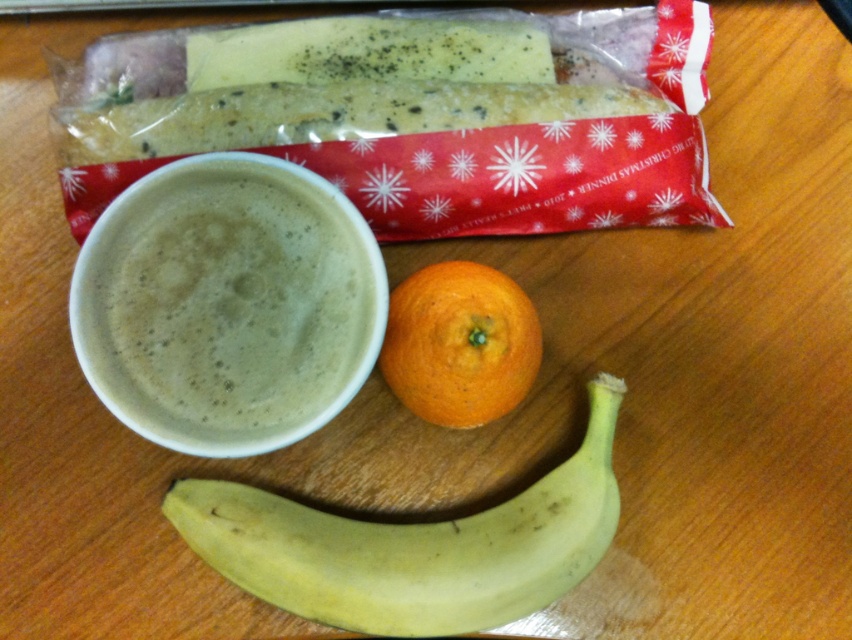
Which is in front, point (291, 609) or point (418, 340)?

Positioned in front is point (291, 609).

In the scene shown: Is green matte banana at lower center bigger than orangesmoothfruit at center?

Indeed, green matte banana at lower center has a larger size compared to orangesmoothfruit at center.

Is point (306, 586) in front of point (403, 394)?

Yes, it is in front of point (403, 394).

Where is `green matte banana at lower center`? The image size is (852, 640). green matte banana at lower center is located at coordinates (413, 545).

Looking at this image, who is higher up, green frothy dip at upper left or orangesmoothfruit at center?

Positioned higher is green frothy dip at upper left.

Which is in front, point (286, 252) or point (468, 262)?

Point (286, 252) is in front.

Is point (263, 275) in front of point (390, 365)?

Yes, point (263, 275) is closer to viewer.

Where is `green frothy dip at upper left`? green frothy dip at upper left is located at coordinates point(227,305).

Is point (301, 310) positioned behind point (301, 561)?

That is True.

The width and height of the screenshot is (852, 640). What are the coordinates of `green frothy dip at upper left` in the screenshot? It's located at (227, 305).